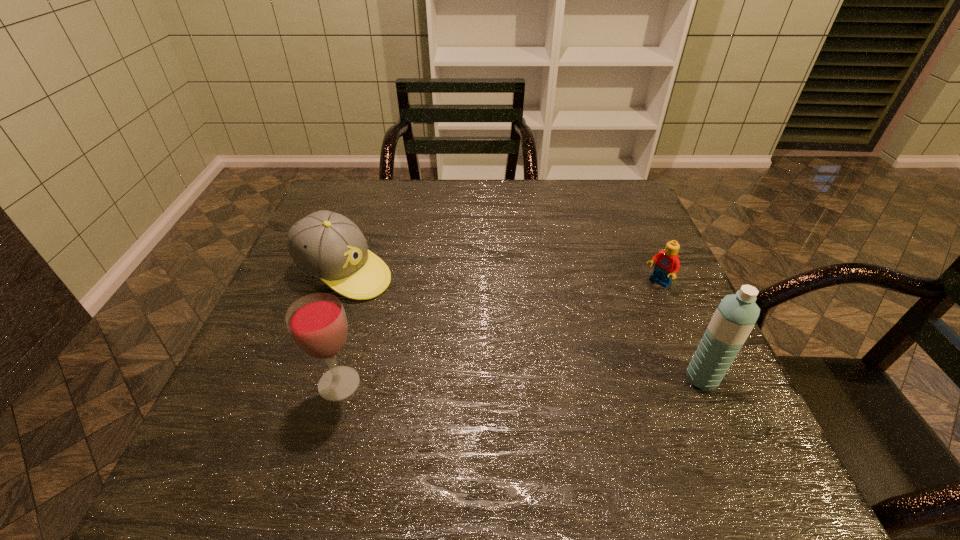
The width and height of the screenshot is (960, 540). Find the location of `vacant space on the desktop that is between the third shortest object and the water bottle and is positioned on the front-facing side of the second shortest object`. vacant space on the desktop that is between the third shortest object and the water bottle and is positioned on the front-facing side of the second shortest object is located at coordinates (552, 380).

You are a GUI agent. You are given a task and a screenshot of the screen. Output one action in this format:
    pyautogui.click(x=<x>, y=<y>)
    Task: Click on the free space on the desktop that is between the second tallest object and the water bottle and is positioned on the face of the Lego
    
    Given the screenshot: What is the action you would take?
    pyautogui.click(x=516, y=381)